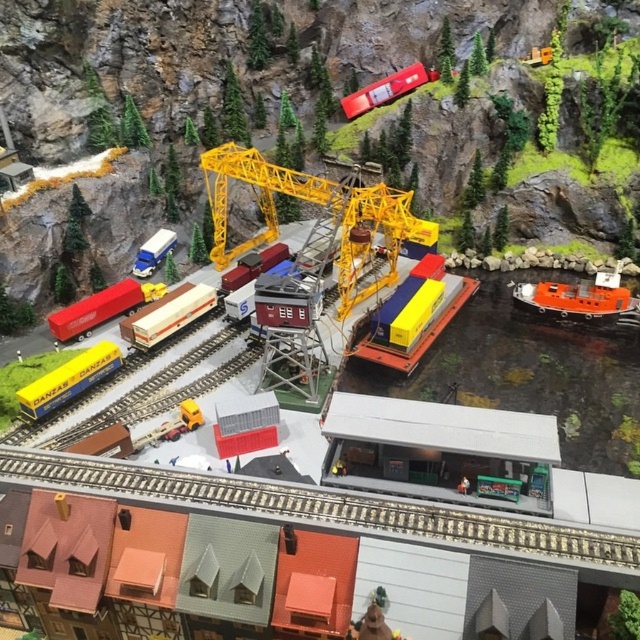
Question: Considering the relative positions of matte blue train car at lower left and wooden grain train car at center in the image provided, where is matte blue train car at lower left located with respect to wooden grain train car at center?

Choices:
 (A) below
 (B) above

Answer: (A)

Question: Which point is farther from the camera taking this photo?

Choices:
 (A) (65, 376)
 (B) (412, 83)
 (C) (161, 307)

Answer: (B)

Question: Which object is positioned closest to the matte blue train car at lower left?

Choices:
 (A) metallic red train at upper center
 (B) wooden grain train car at center
 (C) yellow metallic crane at center

Answer: (B)

Question: Is yellow metallic crane at center to the right of yellow matte container at center from the viewer's perspective?

Choices:
 (A) no
 (B) yes

Answer: (A)

Question: Does yellow matte container at center appear on the right side of metallic red train at upper center?

Choices:
 (A) yes
 (B) no

Answer: (A)

Question: Which of the following is the farthest from the observer?

Choices:
 (A) yellow matte container at center
 (B) metallic red train at upper center
 (C) yellow metallic crane at center
 (D) orange matte boat at right

Answer: (B)